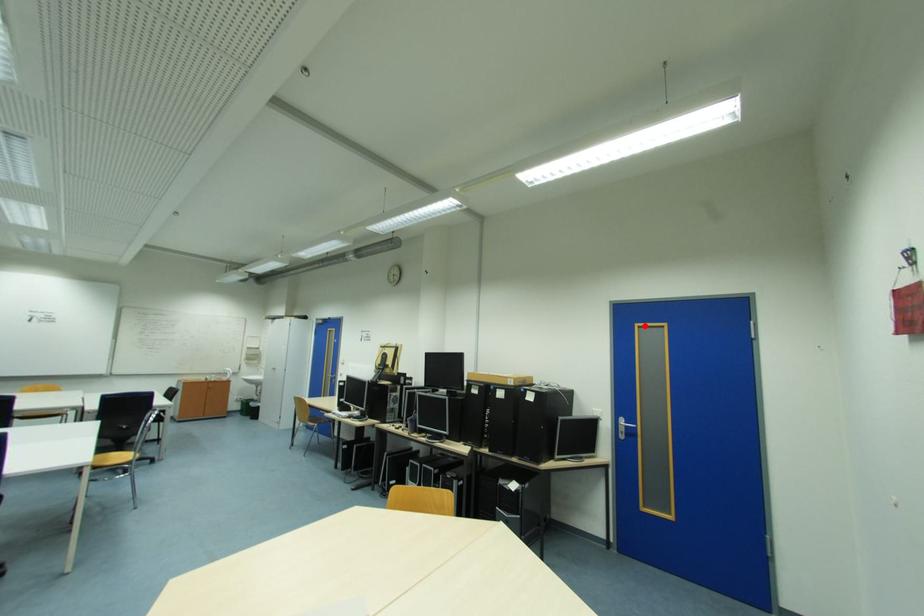
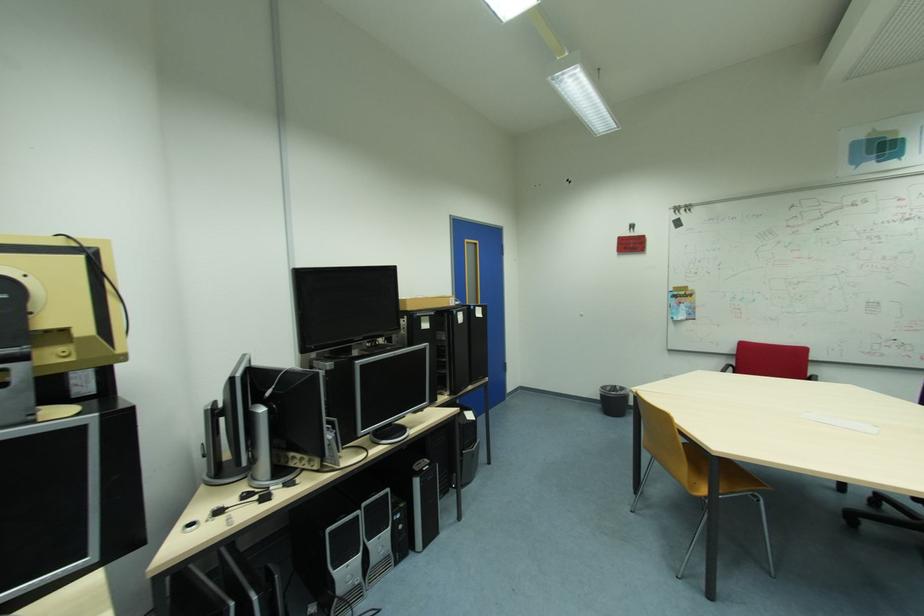
The point at the highlighted location is marked in the first image. Where is the corresponding point in the second image?

(473, 241)